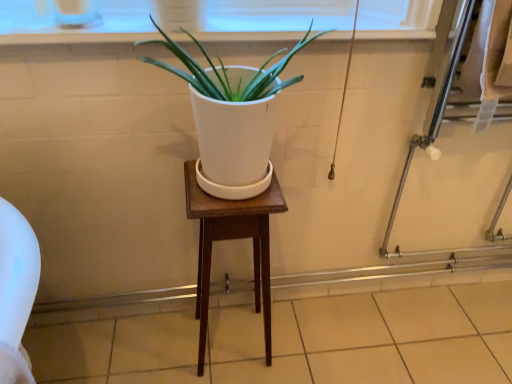
Question: Is wooden stool at center positioned in front of beige tile at lower center?

Choices:
 (A) yes
 (B) no

Answer: (A)

Question: Considering the relative positions of wooden stool at center and beige tile at lower center in the image provided, is wooden stool at center to the left of beige tile at lower center from the viewer's perspective?

Choices:
 (A) no
 (B) yes

Answer: (B)

Question: From the image's perspective, would you say wooden stool at center is positioned over beige tile at lower center?

Choices:
 (A) yes
 (B) no

Answer: (A)

Question: Is wooden stool at center thinner than beige tile at lower center?

Choices:
 (A) no
 (B) yes

Answer: (B)

Question: Is wooden stool at center outside of beige tile at lower center?

Choices:
 (A) no
 (B) yes

Answer: (B)

Question: Is clear glass screen door at right to the left or to the right of white matte pot at center in the image?

Choices:
 (A) left
 (B) right

Answer: (B)

Question: From a real-world perspective, is clear glass screen door at right above or below white matte pot at center?

Choices:
 (A) above
 (B) below

Answer: (B)

Question: In terms of size, does clear glass screen door at right appear bigger or smaller than white matte pot at center?

Choices:
 (A) big
 (B) small

Answer: (A)

Question: Choose the correct answer: Is clear glass screen door at right inside white matte pot at center or outside it?

Choices:
 (A) outside
 (B) inside

Answer: (A)

Question: Is point (392, 215) closer or farther from the camera than point (435, 306)?

Choices:
 (A) farther
 (B) closer

Answer: (B)

Question: Choose the correct answer: Is clear glass screen door at right inside beige tile at lower center or outside it?

Choices:
 (A) outside
 (B) inside

Answer: (A)

Question: From the image's perspective, is clear glass screen door at right located above or below beige tile at lower center?

Choices:
 (A) below
 (B) above

Answer: (B)

Question: Looking at their shapes, would you say clear glass screen door at right is wider or thinner than beige tile at lower center?

Choices:
 (A) thin
 (B) wide

Answer: (A)

Question: Considering the relative positions of white plastic window frame at upper center and wooden stool at center in the image provided, is white plastic window frame at upper center to the left or to the right of wooden stool at center?

Choices:
 (A) left
 (B) right

Answer: (A)

Question: Relative to wooden stool at center, is white plastic window frame at upper center in front or behind?

Choices:
 (A) front
 (B) behind

Answer: (A)